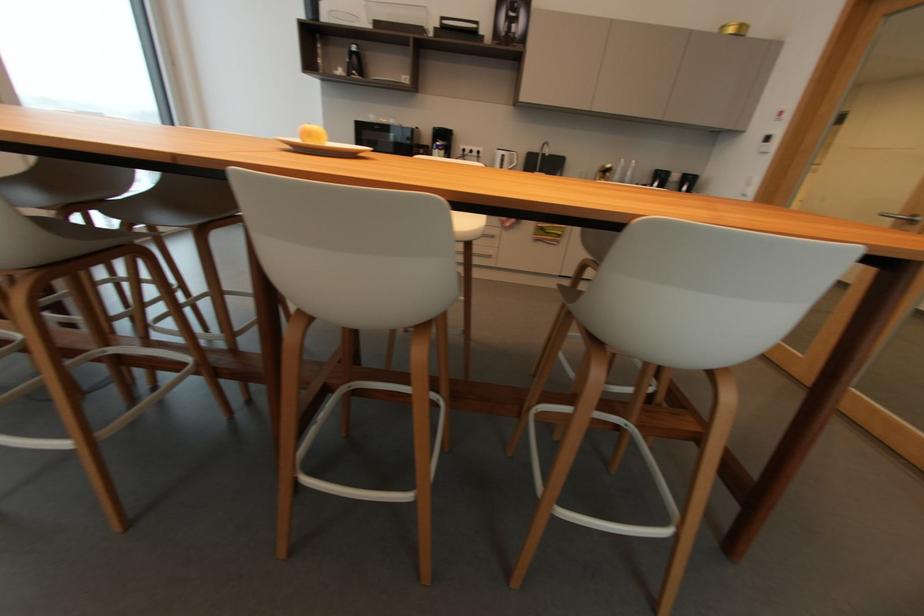
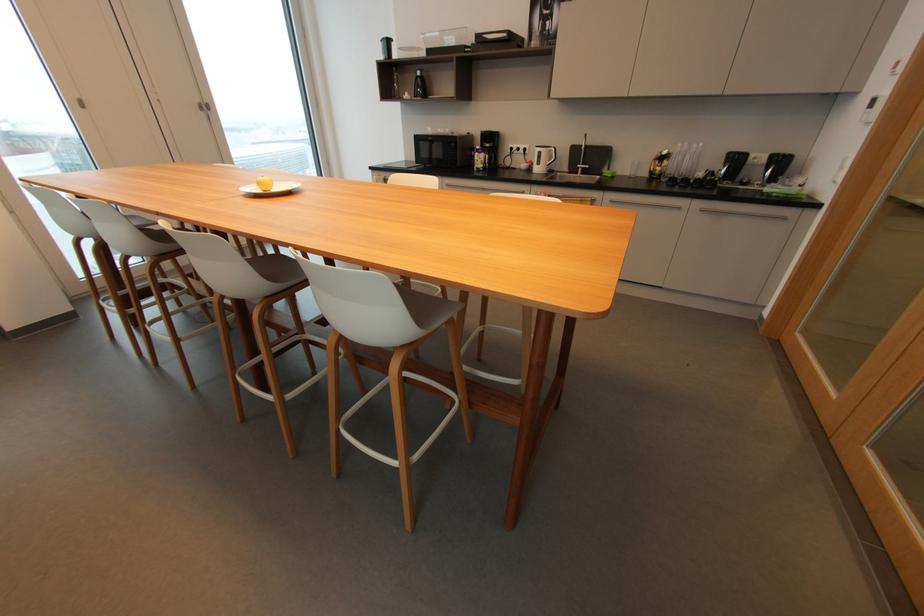
In the second image, find the point that corresponds to [358,49] in the first image.

(421, 74)